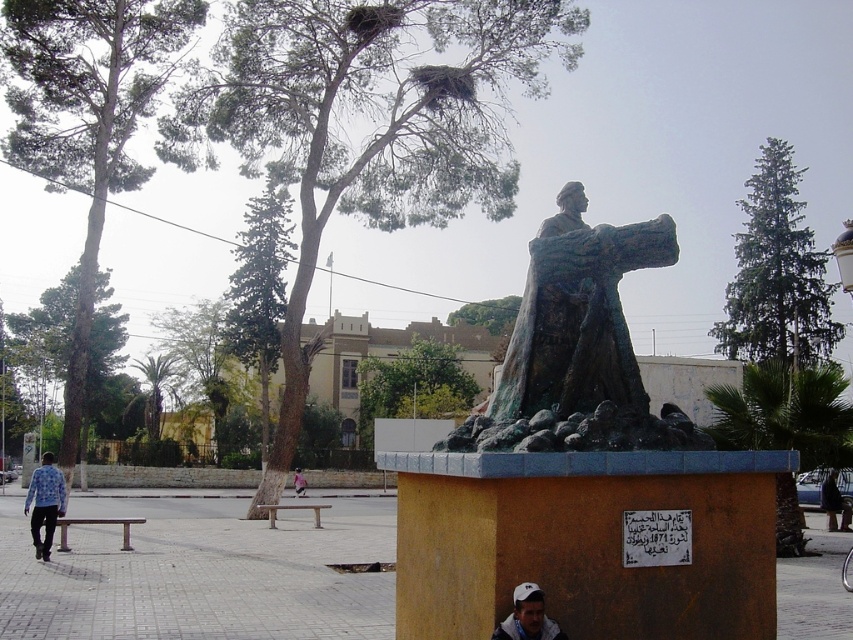
Does dark blue jeans at lower right lie in front of pink fabric at lower center?

Yes.

Between point (828, 531) and point (297, 474), which one is positioned behind?

The point (297, 474) is behind.

Does point (828, 483) come farther from viewer compared to point (299, 481)?

No, it is not.

Identify the location of dark blue jeans at lower right. Image resolution: width=853 pixels, height=640 pixels. (833, 502).

Which is more to the right, green patina bronze statue at center or white cap at center?

From the viewer's perspective, green patina bronze statue at center appears more on the right side.

Who is more forward, (x=642, y=401) or (x=537, y=621)?

Point (x=537, y=621) is more forward.

In order to click on green patina bronze statue at center in this screenshot , I will do `click(578, 346)`.

Can you confirm if blue printed shirt at lower left is positioned below pink fabric at lower center?

Actually, blue printed shirt at lower left is above pink fabric at lower center.

Can you confirm if blue printed shirt at lower left is positioned to the left of pink fabric at lower center?

Correct, you'll find blue printed shirt at lower left to the left of pink fabric at lower center.

Between point (42, 508) and point (299, 488), which one is positioned in front?

Positioned in front is point (42, 508).

Where is `blue printed shirt at lower left`? The width and height of the screenshot is (853, 640). blue printed shirt at lower left is located at coordinates (44, 502).